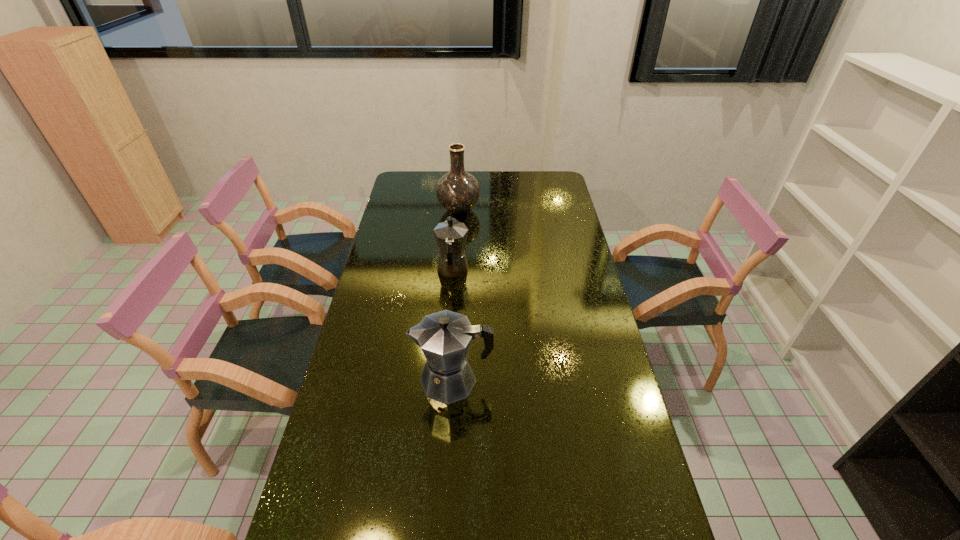
Where is `object that stands as the second closest to the farthest object`? This screenshot has height=540, width=960. object that stands as the second closest to the farthest object is located at coordinates (444, 337).

Find the location of a particular element. This screenshot has height=540, width=960. free space that satisfies the following two spatial constraints: 1. on the pouring side of the vase; 2. on the left side of the second farthest object is located at coordinates (457, 210).

What are the coordinates of `free location that satisfies the following two spatial constraints: 1. on the pouring side of the farthest object; 2. on the left side of the second nearest object` in the screenshot? It's located at (457, 210).